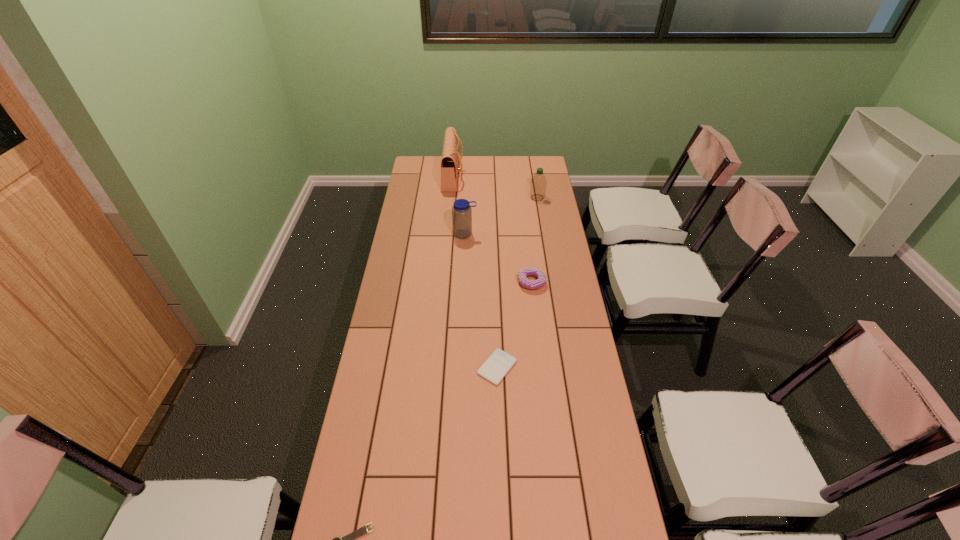
Where is `vacant area in the image that satisfies the following two spatial constraints: 1. on the front-facing side of the second farthest object; 2. on the right side of the handbag`? The height and width of the screenshot is (540, 960). vacant area in the image that satisfies the following two spatial constraints: 1. on the front-facing side of the second farthest object; 2. on the right side of the handbag is located at coordinates (451, 198).